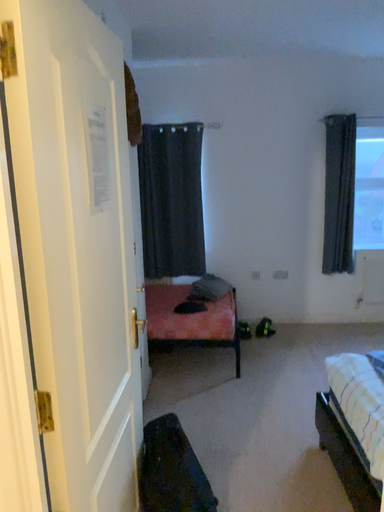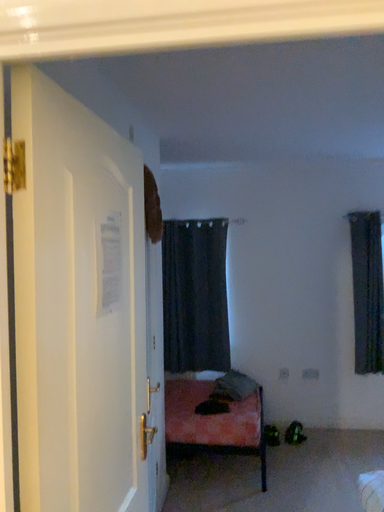
Question: Which way did the camera rotate in the video?

Choices:
 (A) rotated upward
 (B) rotated downward

Answer: (A)